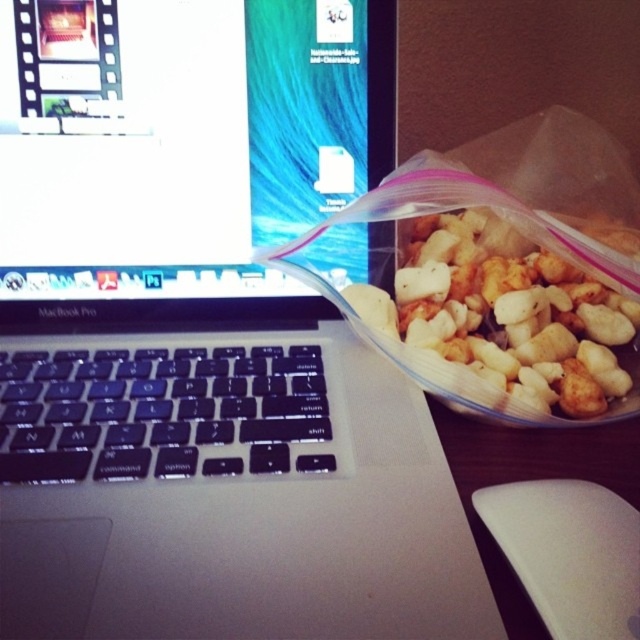
Does matte plastic computer screen at upper left have a greater height compared to white matte nuts at center?

Correct, matte plastic computer screen at upper left is much taller as white matte nuts at center.

Does matte plastic computer screen at upper left have a smaller size compared to white matte nuts at center?

Indeed, matte plastic computer screen at upper left has a smaller size compared to white matte nuts at center.

Does point (349, 256) come closer to viewer compared to point (432, 257)?

Yes, point (349, 256) is in front of point (432, 257).

You are a GUI agent. You are given a task and a screenshot of the screen. Output one action in this format:
    pyautogui.click(x=<x>, y=<y>)
    Task: Click on the matte plastic computer screen at upper left
    This screenshot has height=640, width=640.
    Given the screenshot: What is the action you would take?
    pyautogui.click(x=182, y=138)

Can you confirm if matte plastic computer screen at upper left is wider than white matte mouse at lower right?

Indeed, matte plastic computer screen at upper left has a greater width compared to white matte mouse at lower right.

Which is in front, point (109, 273) or point (616, 516)?

Point (616, 516) is in front.

Describe the element at coordinates (182, 138) in the screenshot. I see `matte plastic computer screen at upper left` at that location.

You are a GUI agent. You are given a task and a screenshot of the screen. Output one action in this format:
    pyautogui.click(x=<x>, y=<y>)
    Task: Click on the matte plastic computer screen at upper left
    
    Given the screenshot: What is the action you would take?
    pyautogui.click(x=182, y=138)

Measure the distance between point (468,296) and camera.

Point (468,296) and camera are 21.33 inches apart.

Image resolution: width=640 pixels, height=640 pixels. In order to click on white matte nuts at center in this screenshot , I will do `click(499, 289)`.

Locate an element on the screen. This screenshot has width=640, height=640. white matte nuts at center is located at coordinates (499, 289).

Where is `white matte nuts at center`? The image size is (640, 640). white matte nuts at center is located at coordinates (499, 289).